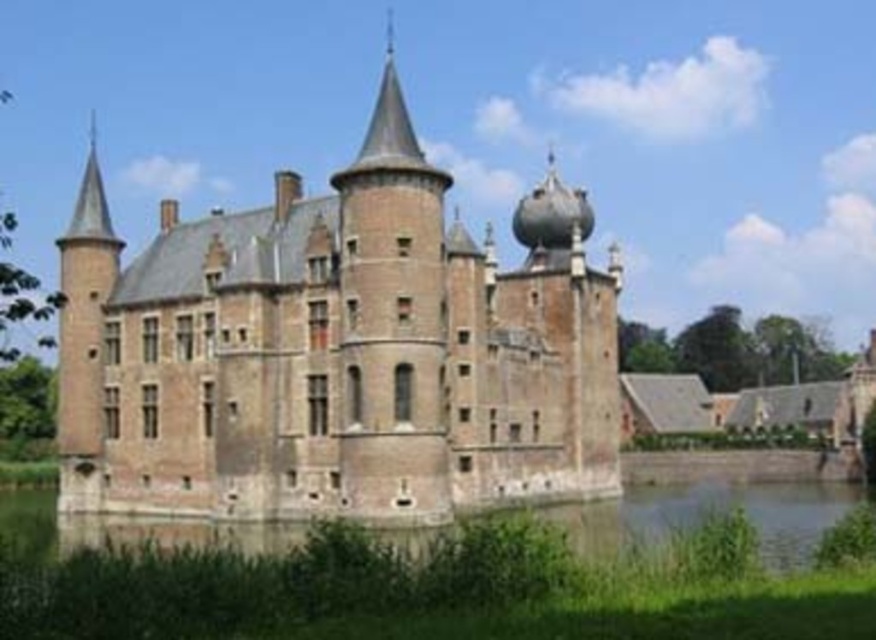
Is point (399, 307) closer to camera compared to point (742, 504)?

Yes, it is.

Who is more distant from viewer, (491, 401) or (788, 522)?

Positioned behind is point (788, 522).

Describe the element at coordinates (337, 349) in the screenshot. The image size is (876, 640). I see `brown brick castle at center` at that location.

What are the coordinates of `brown brick castle at center` in the screenshot? It's located at click(x=337, y=349).